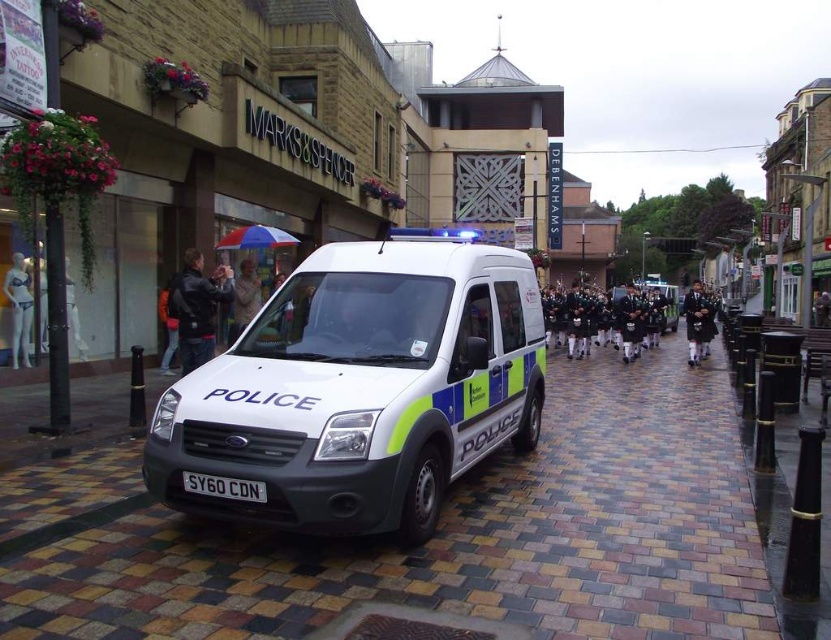
From the picture: Does white matte police van at center have a lesser width compared to white matte mannequin at left?

In fact, white matte police van at center might be wider than white matte mannequin at left.

Between white matte police van at center and white matte mannequin at left, which one appears on the right side from the viewer's perspective?

white matte police van at center

Does point (353, 468) come behind point (23, 292)?

No, (353, 468) is in front of (23, 292).

Identify the location of white matte police van at center. point(361,387).

Does brick paved sidewalk at center have a lesser width compared to white matte mannequin at left?

No, brick paved sidewalk at center is not thinner than white matte mannequin at left.

Can you confirm if brick paved sidewalk at center is bigger than white matte mannequin at left?

Yes.

Is point (745, 636) positioned after point (30, 316)?

No, it is not.

The height and width of the screenshot is (640, 831). Find the location of `brick paved sidewalk at center`. brick paved sidewalk at center is located at coordinates (433, 536).

Can you confirm if brick paved sidewalk at center is positioned to the right of white matte police van at center?

Yes, brick paved sidewalk at center is to the right of white matte police van at center.

Can you confirm if brick paved sidewalk at center is positioned above white matte police van at center?

No, brick paved sidewalk at center is not above white matte police van at center.

At what (x,y) coordinates should I click in order to perform the action: click on brick paved sidewalk at center. Please return your answer as a coordinate pair (x, y). Looking at the image, I should click on 433,536.

This screenshot has height=640, width=831. In order to click on brick paved sidewalk at center in this screenshot , I will do `click(433, 536)`.